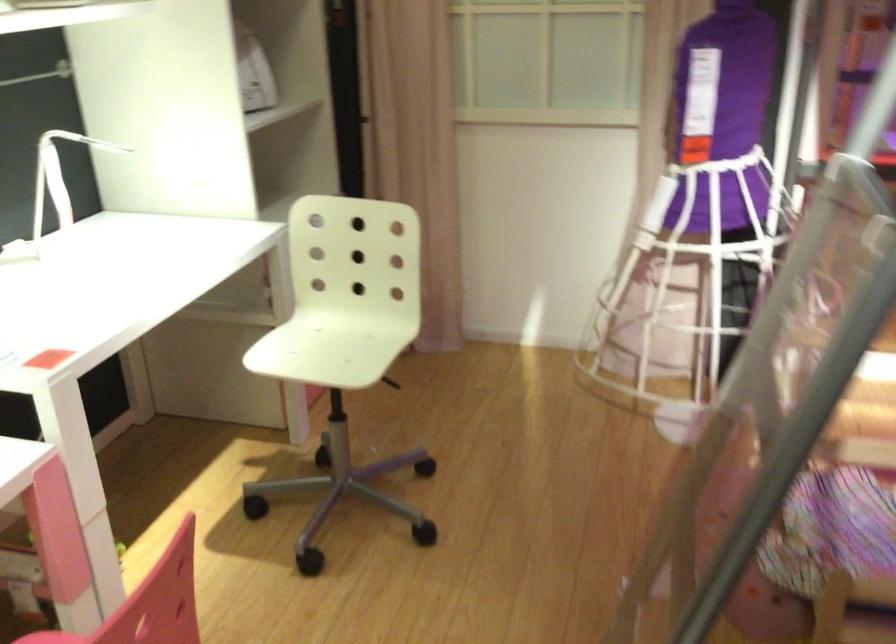
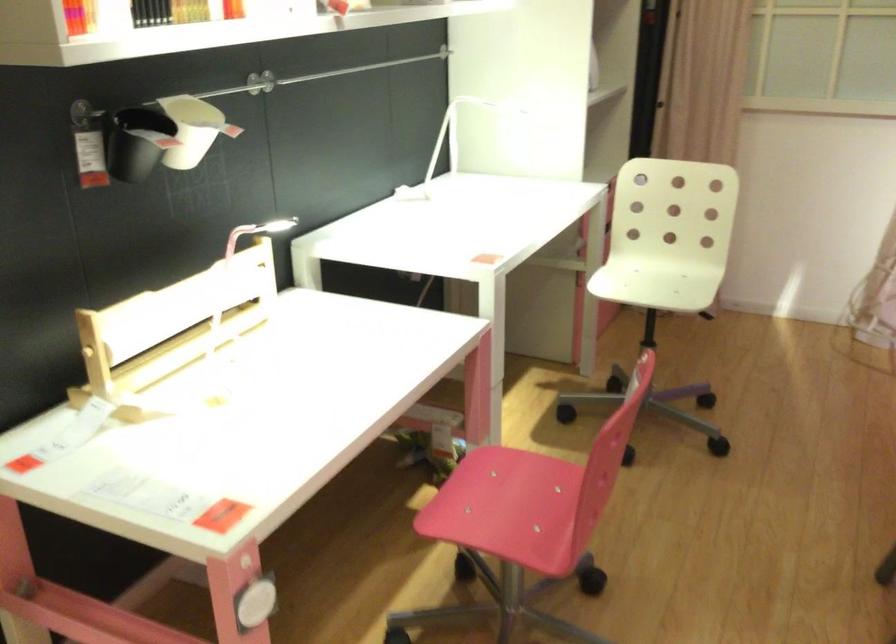
Find the pixel in the second image that matches the point at 346,335 in the first image.

(668, 277)